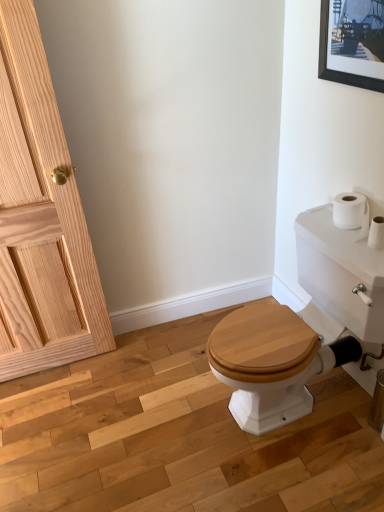
Image resolution: width=384 pixels, height=512 pixels. I want to click on free location in front of white matte toilet paper at upper right, so click(358, 253).